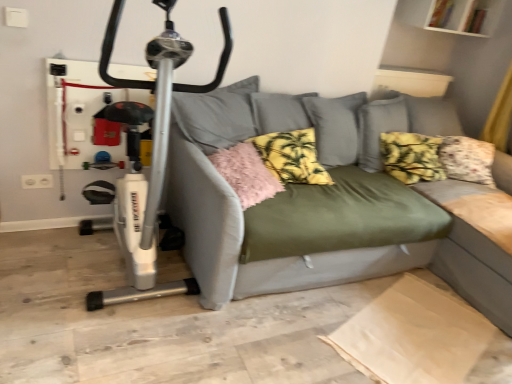
Question: From a real-world perspective, is olive green fabric couch at center physically located above or below pink fluffy pillow at center, arranged as the 3th pillow when viewed from the right?

Choices:
 (A) above
 (B) below

Answer: (B)

Question: Based on their positions, is olive green fabric couch at center located to the left or right of pink fluffy pillow at center, arranged as the 3th pillow when viewed from the right?

Choices:
 (A) left
 (B) right

Answer: (B)

Question: Which object is the closest to the yellow floral cushion at center, which is counted as the third pillow, starting from the left?

Choices:
 (A) pink fluffy pillow at center, which ranks as the first pillow in left-to-right order
 (B) white plastic exercise bike at left
 (C) yellow printed fabric pillow at center, which appears as the second pillow when viewed from the left
 (D) olive green fabric couch at center

Answer: (D)

Question: Considering the real-world distances, which object is farthest from the pink fluffy pillow at center, arranged as the 3th pillow when viewed from the right?

Choices:
 (A) white plastic exercise bike at left
 (B) yellow floral cushion at center, which ranks as the first pillow in right-to-left order
 (C) olive green fabric couch at center
 (D) yellow printed fabric pillow at center, which appears as the second pillow when viewed from the left

Answer: (B)